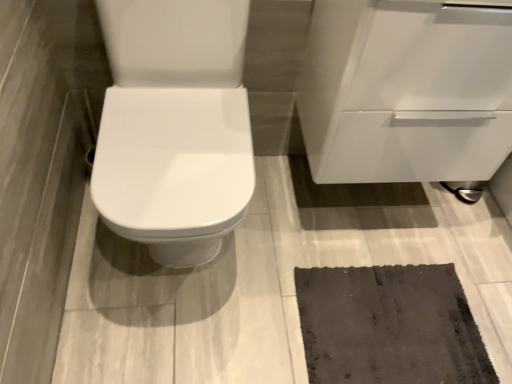
Where is `free space to the left of dark gray textured mat at lower right`? This screenshot has width=512, height=384. free space to the left of dark gray textured mat at lower right is located at coordinates (245, 295).